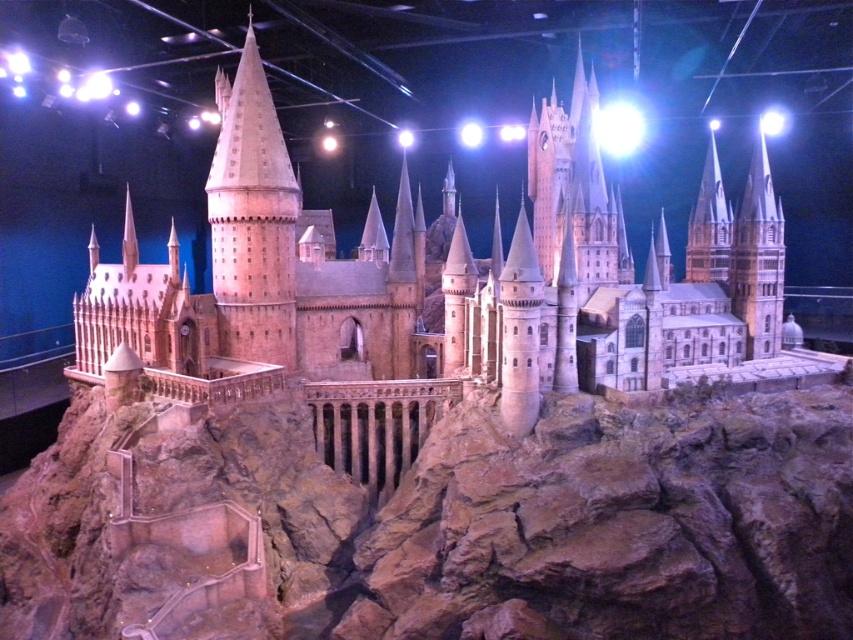
Question: Is smooth beige stone tower at center to the left of smooth stone tower at right from the viewer's perspective?

Choices:
 (A) yes
 (B) no

Answer: (A)

Question: Which of the following is the closest to the observer?

Choices:
 (A) (723, 273)
 (B) (782, 269)
 (C) (265, 156)

Answer: (C)

Question: Among these objects, which one is farthest from the camera?

Choices:
 (A) smooth stone spire at upper right
 (B) smooth stone tower at right
 (C) smooth beige stone tower at center

Answer: (A)

Question: Does smooth stone tower at right appear on the left side of smooth stone spire at upper right?

Choices:
 (A) yes
 (B) no

Answer: (A)

Question: Where is matte brown castle at center located in relation to smooth beige stone tower at center in the image?

Choices:
 (A) left
 (B) right

Answer: (B)

Question: Which point is closer to the camera taking this photo?

Choices:
 (A) (267, 266)
 (B) (245, 291)
 (C) (756, 198)

Answer: (B)